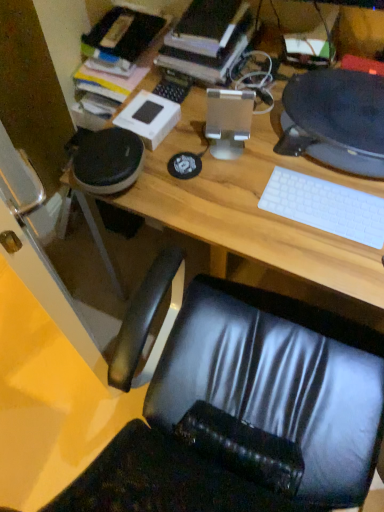
Where is `free point in front of white matte keyboard at right`? The height and width of the screenshot is (512, 384). free point in front of white matte keyboard at right is located at coordinates (331, 258).